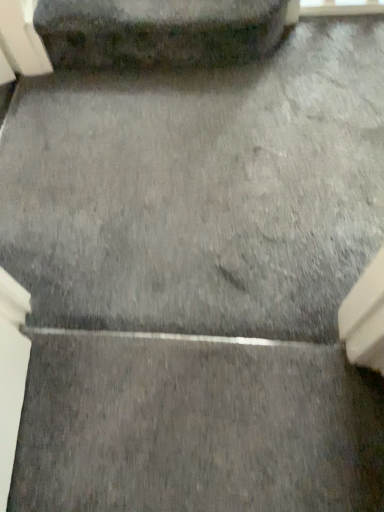
Question: Should I look upward or downward to see dark gray stone at upper center?

Choices:
 (A) up
 (B) down

Answer: (A)